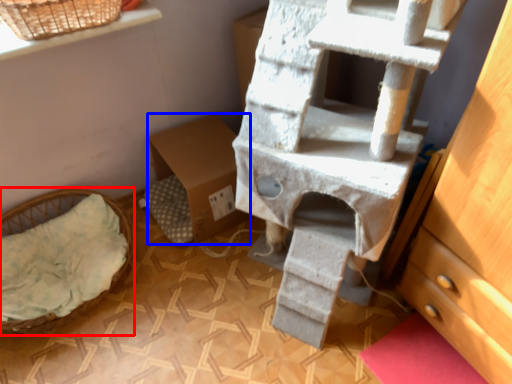
Question: Among these objects, which one is farthest to the camera, furniture (highlighted by a red box) or cardboard box (highlighted by a blue box)?

Choices:
 (A) furniture
 (B) cardboard box

Answer: (B)